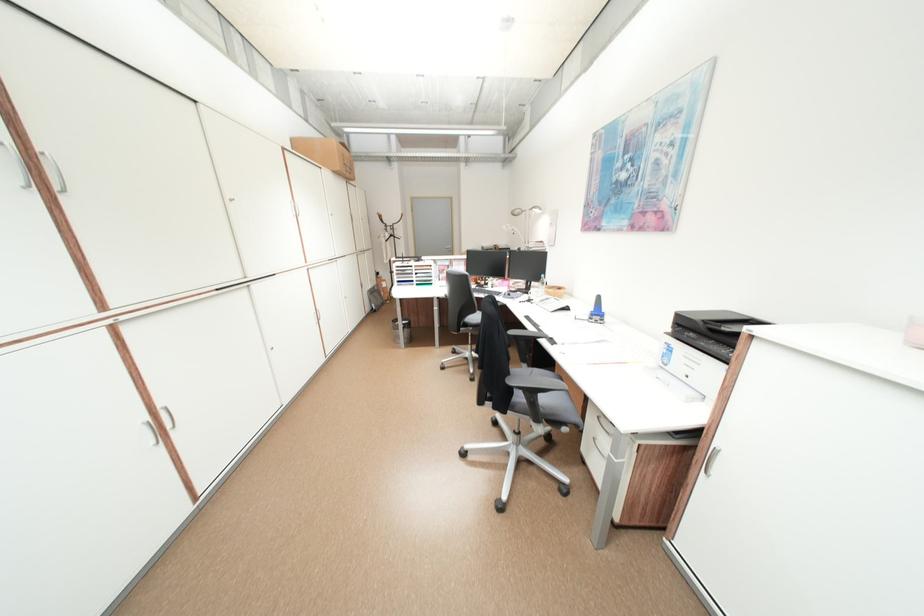
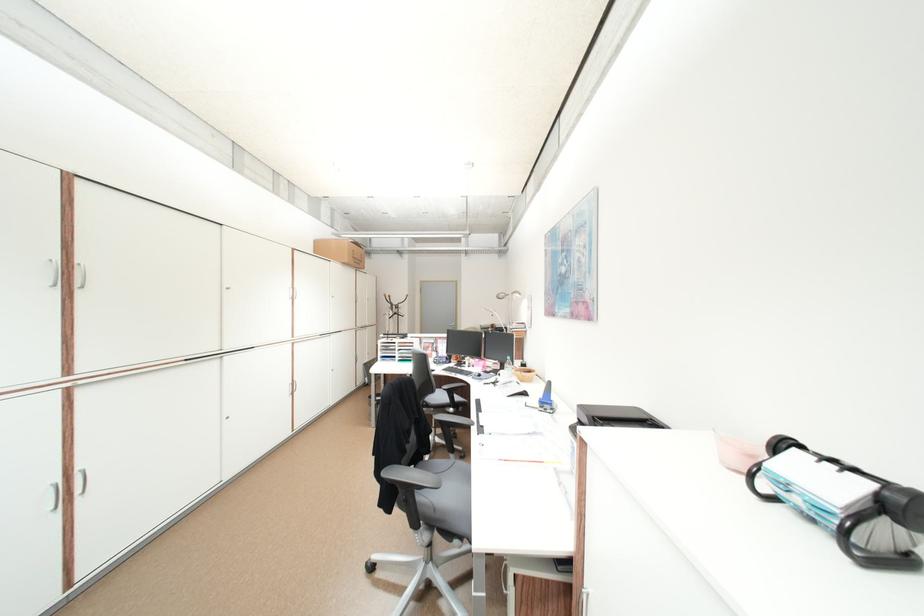
In the second image, find the point that corresponds to pixel 533 286 in the first image.

(507, 368)